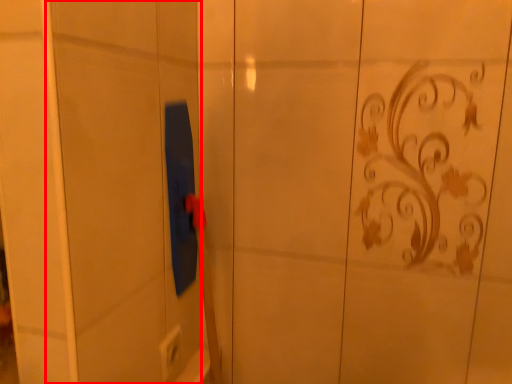
Question: From the image's perspective, where is screen door (annotated by the red box) located relative to electric outlet?

Choices:
 (A) above
 (B) below

Answer: (A)